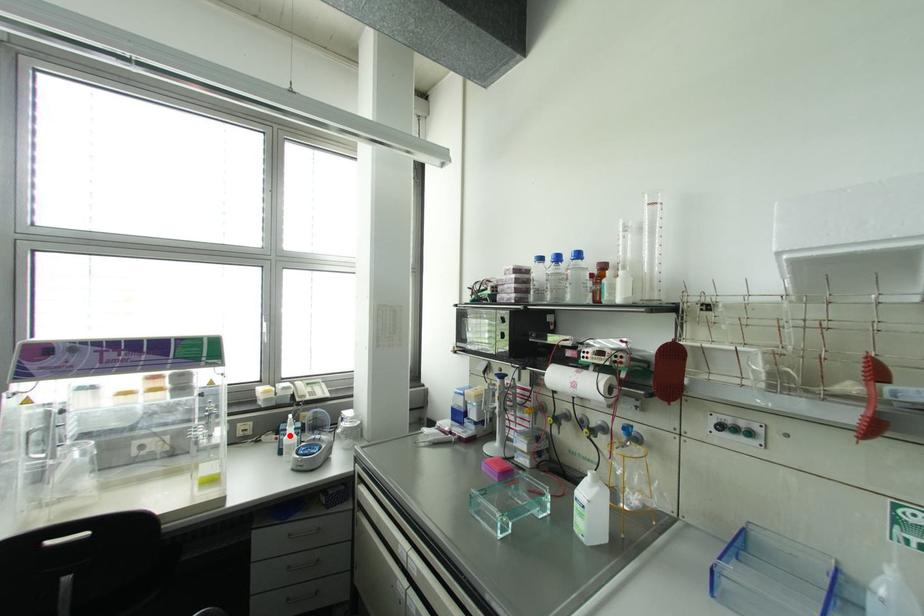
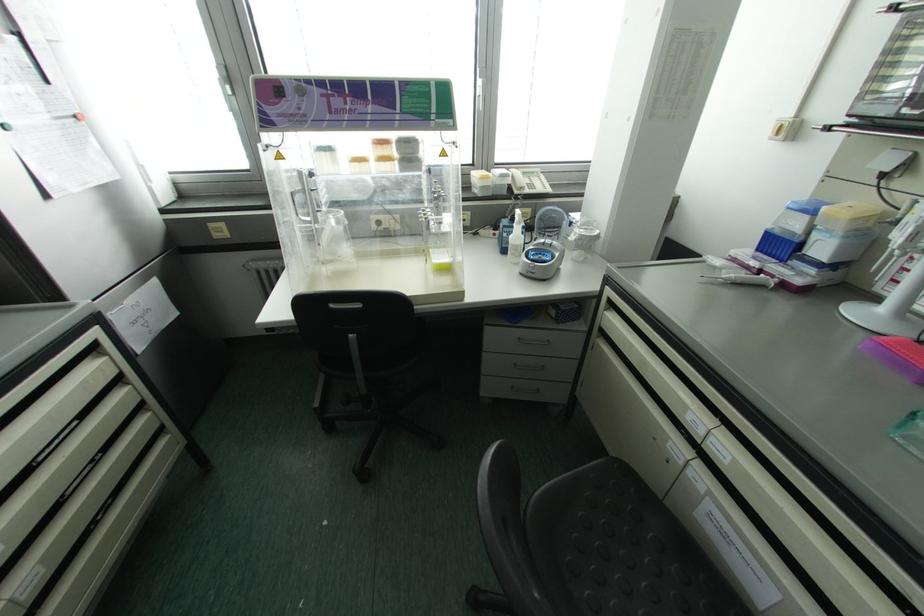
The point at the highlighted location is marked in the first image. Where is the corresponding point in the second image?

(516, 235)